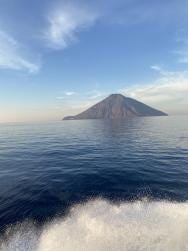
The width and height of the screenshot is (188, 251). Find the location of `island left side`. island left side is located at coordinates (63, 117).